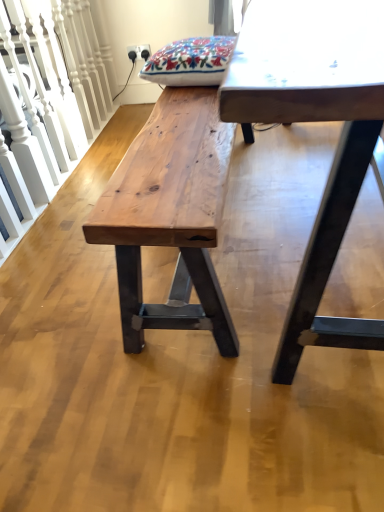
Find the location of a particular element. natural wood bench at center is located at coordinates (170, 215).

Identify the location of natural wood bench at left. The image size is (384, 512). (42, 102).

The height and width of the screenshot is (512, 384). Find the location of `natural wood bench at center`. natural wood bench at center is located at coordinates (170, 215).

Which object is more forward, smooth white table at center or natural wood bench at left?

smooth white table at center is more forward.

Can you confirm if smooth white table at center is shorter than natural wood bench at left?

Indeed, smooth white table at center has a lesser height compared to natural wood bench at left.

Could natural wood bench at left be considered to be inside smooth white table at center?

Definitely not — natural wood bench at left is not inside smooth white table at center.

Which is in front, point (163, 314) or point (314, 281)?

The point (314, 281) is closer.

Does natural wood bench at center turn towards smooth white table at center?

Yes, natural wood bench at center is facing smooth white table at center.

Which object is thinner, natural wood bench at center or smooth white table at center?

natural wood bench at center is thinner.

Which of these two, natural wood bench at left or natural wood bench at center, is bigger?

Bigger between the two is natural wood bench at center.

Is the surface of natural wood bench at left in direct contact with natural wood bench at center?

No, natural wood bench at left is not touching natural wood bench at center.

Which is more to the right, natural wood bench at left or natural wood bench at center?

natural wood bench at center is more to the right.

Does point (52, 31) come behind point (197, 202)?

Yes, point (52, 31) is behind point (197, 202).

Would you say natural wood bench at left is part of natural wood bench at center's contents?

No, natural wood bench at left is not inside natural wood bench at center.

Can you confirm if natural wood bench at center is positioned to the left of natural wood bench at left?

Incorrect, natural wood bench at center is not on the left side of natural wood bench at left.

Are natural wood bench at center and natural wood bench at left located far from each other?

They are positioned close to each other.

Visually, is smooth white table at center positioned to the left or to the right of natural wood bench at center?

In the image, smooth white table at center appears on the right side of natural wood bench at center.

Does point (249, 37) appear closer or farther from the camera than point (132, 195)?

Point (249, 37) is closer to the camera than point (132, 195).

Looking at this image, what's the angular difference between smooth white table at center and natural wood bench at center's facing directions?

There is a 178-degree angle between the facing directions of smooth white table at center and natural wood bench at center.

From the image's perspective, does smooth white table at center appear higher than natural wood bench at center?

Yes, from the image's perspective, smooth white table at center is on top of natural wood bench at center.

In the scene shown: Which object is thinner, natural wood bench at left or smooth white table at center?

natural wood bench at left is thinner.

Considering the relative sizes of natural wood bench at left and smooth white table at center in the image provided, is natural wood bench at left taller than smooth white table at center?

Yes, natural wood bench at left is taller than smooth white table at center.

From the image's perspective, between natural wood bench at left and smooth white table at center, who is located below?

smooth white table at center appears lower in the image.

Does natural wood bench at left have a larger size compared to smooth white table at center?

No.

I want to click on rail on the left side of smooth white table at center, so click(x=42, y=102).

Identify the location of bench behind the smooth white table at center. (170, 215).

Which object lies further to the anchor point natural wood bench at left, smooth white table at center or natural wood bench at center?

Among the two, smooth white table at center is located further to natural wood bench at left.

From the image, which object appears to be nearer to natural wood bench at center, natural wood bench at left or smooth white table at center?

Among the two, smooth white table at center is located nearer to natural wood bench at center.

Considering their positions, is smooth white table at center positioned further to natural wood bench at center than natural wood bench at left?

natural wood bench at left is positioned further to the anchor natural wood bench at center.

When comparing their distances from smooth white table at center, does natural wood bench at center or natural wood bench at left seem closer?

The object closer to smooth white table at center is natural wood bench at center.

Which object lies nearer to the anchor point smooth white table at center, natural wood bench at left or natural wood bench at center?

natural wood bench at center is positioned closer to the anchor smooth white table at center.

Which object lies further to the anchor point natural wood bench at left, natural wood bench at center or smooth white table at center?

Among the two, smooth white table at center is located further to natural wood bench at left.

Locate an element on the screen. The width and height of the screenshot is (384, 512). bench between natural wood bench at left and smooth white table at center is located at coordinates (170, 215).